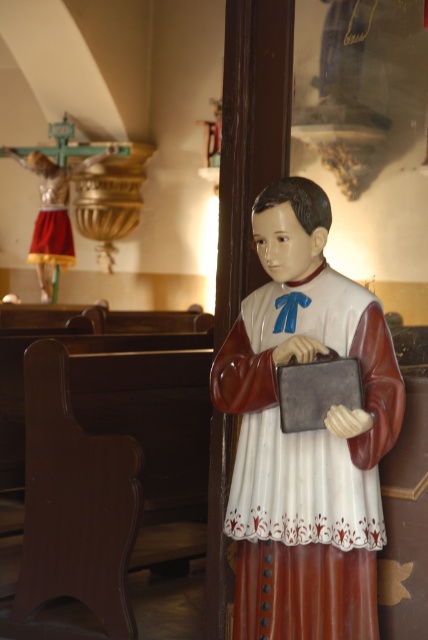
Can you confirm if matte plastic statue at center is smaller than matte gold statue at upper left?

Indeed, matte plastic statue at center has a smaller size compared to matte gold statue at upper left.

Does matte plastic statue at center come behind matte gold statue at upper left?

No, it is in front of matte gold statue at upper left.

Between point (326, 432) and point (36, 260), which one is positioned in front?

Positioned in front is point (326, 432).

In order to click on matte plastic statue at center in this screenshot , I will do `click(305, 435)`.